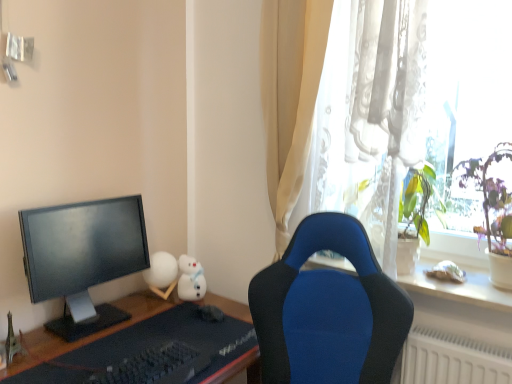
Question: From a real-world perspective, is white plush toy at upper right, the fourth toy in the left-to-right sequence, positioned under metallic silver eiffel tower at lower left, positioned as the first toy in front-to-back order, based on gravity?

Choices:
 (A) yes
 (B) no

Answer: (B)

Question: Is white plush toy at upper right, the third toy viewed from the back, positioned far away from metallic silver eiffel tower at lower left, positioned as the first toy in front-to-back order?

Choices:
 (A) yes
 (B) no

Answer: (A)

Question: Is metallic silver eiffel tower at lower left, which is counted as the 4th toy, starting from the back, surrounded by white plush toy at upper right, the third toy viewed from the back?

Choices:
 (A) no
 (B) yes

Answer: (A)

Question: Can we say white plush toy at upper right, the second toy in the front-to-back sequence, lies outside metallic silver eiffel tower at lower left, which is counted as the 4th toy, starting from the back?

Choices:
 (A) no
 (B) yes

Answer: (B)

Question: Is white plush toy at upper right, the third toy viewed from the back, further to camera compared to metallic silver eiffel tower at lower left, placed as the 4th toy when sorted from right to left?

Choices:
 (A) yes
 (B) no

Answer: (A)

Question: From a real-world perspective, relative to metallic silver eiffel tower at lower left, placed as the 4th toy when sorted from right to left, is green leafy plant at right vertically above or below?

Choices:
 (A) above
 (B) below

Answer: (A)

Question: Looking at the image, does green leafy plant at right seem bigger or smaller compared to metallic silver eiffel tower at lower left, arranged as the 1th toy when viewed from the left?

Choices:
 (A) small
 (B) big

Answer: (B)

Question: Looking at their shapes, would you say green leafy plant at right is wider or thinner than metallic silver eiffel tower at lower left, positioned as the first toy in front-to-back order?

Choices:
 (A) wide
 (B) thin

Answer: (A)

Question: From their relative heights in the image, would you say green leafy plant at right is taller or shorter than metallic silver eiffel tower at lower left, which is counted as the 4th toy, starting from the back?

Choices:
 (A) short
 (B) tall

Answer: (B)

Question: Would you say white matte sphere at center-left, positioned as the 4th toy in front-to-back order, is to the left or to the right of green leafy plant at right in the picture?

Choices:
 (A) right
 (B) left

Answer: (B)

Question: Do you think white matte sphere at center-left, which is the first toy from back to front, is within green leafy plant at right, or outside of it?

Choices:
 (A) inside
 (B) outside

Answer: (B)

Question: From the image's perspective, is white matte sphere at center-left, which is the first toy from back to front, positioned above or below green leafy plant at right?

Choices:
 (A) below
 (B) above

Answer: (A)

Question: From a real-world perspective, is white matte sphere at center-left, positioned as the 4th toy in front-to-back order, positioned above or below green leafy plant at right?

Choices:
 (A) below
 (B) above

Answer: (A)

Question: From the image's perspective, is white matte sphere at center-left, placed as the 3th toy when sorted from right to left, above or below black matte keyboard at lower center?

Choices:
 (A) above
 (B) below

Answer: (A)

Question: Considering the relative positions of white matte sphere at center-left, positioned as the 4th toy in front-to-back order, and black matte keyboard at lower center in the image provided, is white matte sphere at center-left, positioned as the 4th toy in front-to-back order, to the left or to the right of black matte keyboard at lower center?

Choices:
 (A) right
 (B) left

Answer: (B)